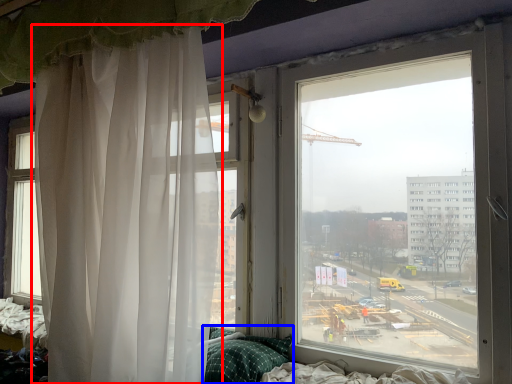
Question: Which object is closer to the camera taking this photo, curtain (highlighted by a red box) or pillow (highlighted by a blue box)?

Choices:
 (A) curtain
 (B) pillow

Answer: (A)